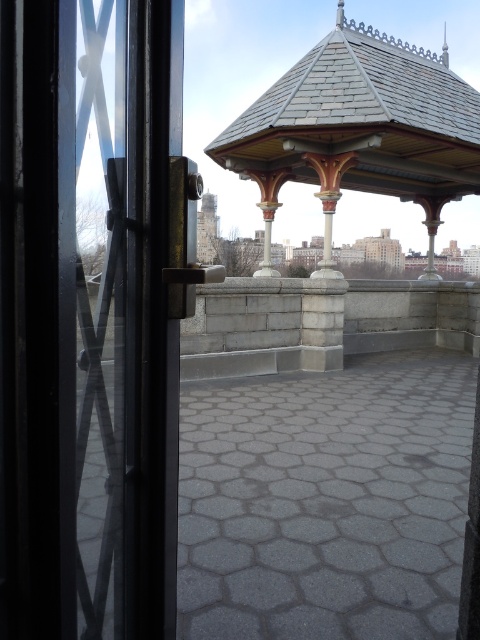
Is transparent glass door at left above gray slate gazebo at upper center?

Incorrect, transparent glass door at left is not positioned above gray slate gazebo at upper center.

Between transparent glass door at left and gray slate gazebo at upper center, which one is positioned lower?

transparent glass door at left

Where is `transparent glass door at left`? transparent glass door at left is located at coordinates (84, 332).